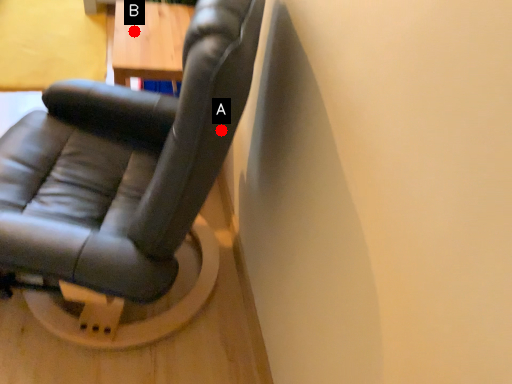
Question: Two points are circled on the image, labeled by A and B beside each circle. Which point is closer to the camera?

Choices:
 (A) A is closer
 (B) B is closer

Answer: (A)